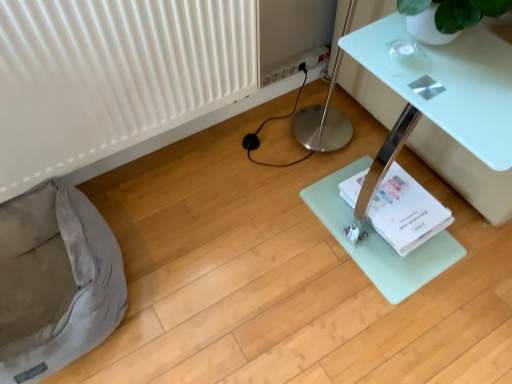
In order to face white glossy table at lower right, should I rotate leftwards or rightwards?

Turn right by 33.194 degrees to look at white glossy table at lower right.

Where is `gray fabric bean bag at lower left`? This screenshot has height=384, width=512. gray fabric bean bag at lower left is located at coordinates (55, 282).

What do you see at coordinates (113, 76) in the screenshot? The height and width of the screenshot is (384, 512). I see `white ribbed radiator at lower left` at bounding box center [113, 76].

At what (x,y) coordinates should I click in order to perform the action: click on white glossy table at lower right. Please return your answer as a coordinate pair (x, y). This screenshot has height=384, width=512. Looking at the image, I should click on (465, 171).

Can you tell me how much white ribbed radiator at lower left and white plastic power strip at upper center differ in facing direction?

The facing directions of white ribbed radiator at lower left and white plastic power strip at upper center are 0.486 degrees apart.

From the image's perspective, between white ribbed radiator at lower left and white plastic power strip at upper center, who is located below?

white ribbed radiator at lower left appears lower in the image.

Does point (26, 37) lie behind point (282, 63)?

No, it is not.

Which of these two, white ribbed radiator at lower left or white plastic power strip at upper center, stands taller?

white ribbed radiator at lower left is taller.

From a real-world perspective, is white glossy table at lower right on white paper at lower right?

Yes, from a real-world perspective, white glossy table at lower right is on top of white paper at lower right.

Considering the relative sizes of white glossy table at lower right and white paper at lower right in the image provided, is white glossy table at lower right bigger than white paper at lower right?

Correct, white glossy table at lower right is larger in size than white paper at lower right.

Is white glossy table at lower right placed right next to white paper at lower right?

white glossy table at lower right is not next to white paper at lower right, and they're not touching.

Can you confirm if gray fabric bean bag at lower left is thinner than white paper at lower right?

No, gray fabric bean bag at lower left is not thinner than white paper at lower right.

Which object is closer to the camera taking this photo, gray fabric bean bag at lower left or white paper at lower right?

Positioned in front is gray fabric bean bag at lower left.

Can white paper at lower right be found inside gray fabric bean bag at lower left?

Actually, white paper at lower right is outside gray fabric bean bag at lower left.

Could you tell me if gray fabric bean bag at lower left is turned towards white paper at lower right?

No, gray fabric bean bag at lower left is not oriented towards white paper at lower right.

From a real-world perspective, who is located higher, white glossy table at lower right or gray fabric bean bag at lower left?

white glossy table at lower right, from a real-world perspective.

From the image's perspective, is white glossy table at lower right positioned above or below gray fabric bean bag at lower left?

Based on their image positions, white glossy table at lower right is located above gray fabric bean bag at lower left.

Considering the relative positions of white glossy table at lower right and gray fabric bean bag at lower left in the image provided, is white glossy table at lower right to the left of gray fabric bean bag at lower left from the viewer's perspective?

In fact, white glossy table at lower right is to the right of gray fabric bean bag at lower left.

From the picture: Does white glossy table at lower right turn towards gray fabric bean bag at lower left?

No, white glossy table at lower right is not facing towards gray fabric bean bag at lower left.

Is white plastic power strip at upper center aimed at white glossy table at lower right?

No, white plastic power strip at upper center is not oriented towards white glossy table at lower right.

From a real-world perspective, is white plastic power strip at upper center above or below white glossy table at lower right?

In terms of real-world spatial position, white plastic power strip at upper center is below white glossy table at lower right.

Which is closer to the camera, (295, 65) or (384, 89)?

Positioned in front is point (384, 89).

In the image, is white plastic power strip at upper center positioned in front of or behind white glossy table at lower right?

Visually, white plastic power strip at upper center is located behind white glossy table at lower right.

Based on the photo, which of these two, white plastic power strip at upper center or white paper at lower right, is wider?

Wider between the two is white paper at lower right.

Is white plastic power strip at upper center oriented towards white paper at lower right?

Yes, white plastic power strip at upper center is facing white paper at lower right.

Based on their positions, is white plastic power strip at upper center located to the left or right of white paper at lower right?

Based on their positions, white plastic power strip at upper center is located to the left of white paper at lower right.

Does point (265, 76) appear closer or farther from the camera than point (418, 210)?

Point (265, 76) appears to be farther away from the viewer than point (418, 210).

From a real-world perspective, which is physically below, white ribbed radiator at lower left or gray fabric bean bag at lower left?

gray fabric bean bag at lower left, from a real-world perspective.

Is point (203, 40) behind point (49, 197)?

No, it is not.

Locate an element on the screen. radiator located in front of the gray fabric bean bag at lower left is located at coordinates (113, 76).

Is white ribbed radiator at lower left positioned in front of gray fabric bean bag at lower left?

Yes, the depth of white ribbed radiator at lower left is less than that of gray fabric bean bag at lower left.

Locate an element on the screen. radiator below the white plastic power strip at upper center (from the image's perspective) is located at coordinates coord(113,76).

Where is `table in front of the white paper at lower right`? table in front of the white paper at lower right is located at coordinates (465, 171).

In the scene shown: Based on their spatial positions, is gray fabric bean bag at lower left or white glossy table at lower right further from white plastic power strip at upper center?

The object further to white plastic power strip at upper center is gray fabric bean bag at lower left.

From the image, which object appears to be nearer to white glossy table at lower right, white ribbed radiator at lower left or white paper at lower right?

white paper at lower right is closer to white glossy table at lower right.

Consider the image. Estimate the real-world distances between objects in this image. Which object is further from white ribbed radiator at lower left, gray fabric bean bag at lower left or white paper at lower right?

white paper at lower right is positioned further to the anchor white ribbed radiator at lower left.

When comparing their distances from white glossy table at lower right, does white ribbed radiator at lower left or gray fabric bean bag at lower left seem closer?

Among the two, white ribbed radiator at lower left is located nearer to white glossy table at lower right.

When comparing their distances from white plastic power strip at upper center, does white paper at lower right or white glossy table at lower right seem further?

Among the two, white paper at lower right is located further to white plastic power strip at upper center.

In the scene shown: Which object lies nearer to the anchor point white plastic power strip at upper center, white glossy table at lower right or gray fabric bean bag at lower left?

white glossy table at lower right lies closer to white plastic power strip at upper center than the other object.

Looking at the image, which one is located closer to white paper at lower right, white plastic power strip at upper center or gray fabric bean bag at lower left?

white plastic power strip at upper center is positioned closer to the anchor white paper at lower right.

Based on their spatial positions, is white ribbed radiator at lower left or white glossy table at lower right further from white paper at lower right?

white ribbed radiator at lower left is further to white paper at lower right.

I want to click on paperback book situated between gray fabric bean bag at lower left and white glossy table at lower right from left to right, so click(406, 212).

Identify the location of radiator located between gray fabric bean bag at lower left and white glossy table at lower right in the left-right direction. The width and height of the screenshot is (512, 384). (113, 76).

This screenshot has height=384, width=512. I want to click on electric outlet between gray fabric bean bag at lower left and white glossy table at lower right in the horizontal direction, so click(x=294, y=64).

You are a GUI agent. You are given a task and a screenshot of the screen. Output one action in this format:
    pyautogui.click(x=<x>, y=<y>)
    Task: Click on the paperback book between white ribbed radiator at lower left and white glossy table at lower right in the horizontal direction
    The width and height of the screenshot is (512, 384).
    Given the screenshot: What is the action you would take?
    click(x=406, y=212)